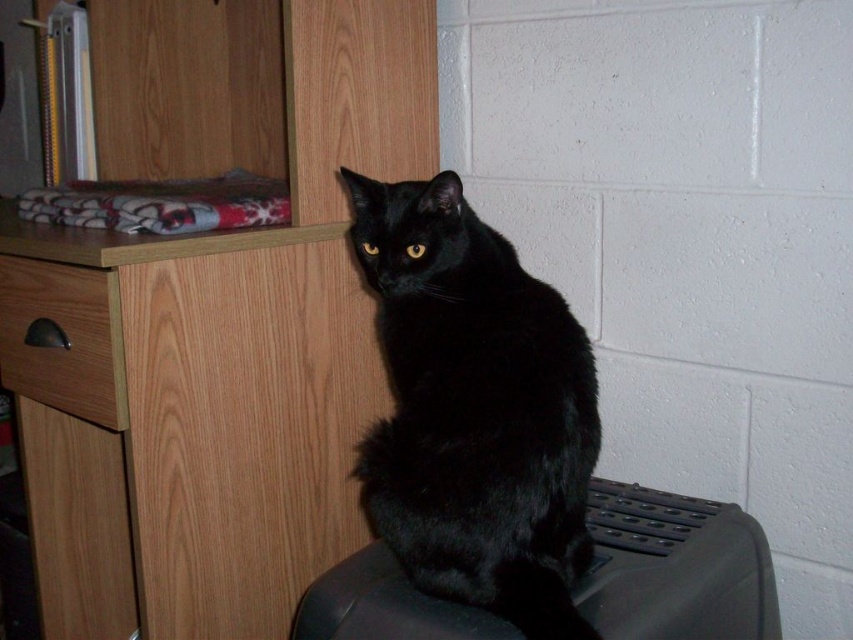
Question: Does black fur cat at center come in front of black plastic swivel chair at lower right?

Choices:
 (A) no
 (B) yes

Answer: (B)

Question: Which of these objects is positioned farthest from the black plastic swivel chair at lower right?

Choices:
 (A) brushed wood drawer at left
 (B) black fur cat at center
 (C) wooden cabinet at upper left

Answer: (A)

Question: Does black plastic swivel chair at lower right lie in front of brushed wood drawer at left?

Choices:
 (A) yes
 (B) no

Answer: (A)

Question: Is wooden cabinet at upper left thinner than black fur cat at center?

Choices:
 (A) no
 (B) yes

Answer: (A)

Question: Estimate the real-world distances between objects in this image. Which object is closer to the wooden cabinet at upper left?

Choices:
 (A) black fur cat at center
 (B) brushed wood drawer at left

Answer: (B)

Question: Which point is closer to the camera taking this photo?

Choices:
 (A) (397, 440)
 (B) (148, 13)
 (C) (656, 588)

Answer: (C)